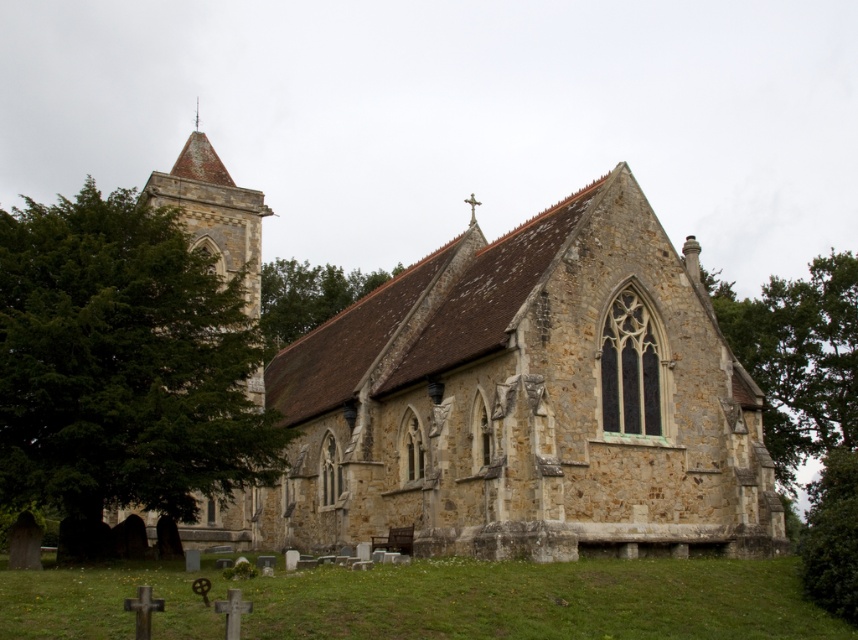
You are standing in front of the church and want to take a photo of the green leafy tree at left. Which direction should you face to capture it in your camera?

The green leafy tree at left is located at point 0.577 on the x axis and 0.142 on the y axis. Since the x coordinate is greater than 0.5, it is positioned to the right side of the image. Therefore, you should face to the right to capture the green leafy tree at left in your camera.

You are standing at the entrance of the church and want to take a photo of the green leafy tree at left. Which direction should you face to capture the tree in your view?

The green leafy tree at left is located at point 0.577 on the x and 0.142 on the y, so you should face towards the left side of the church to capture the tree in your view.

You are standing in front of the church and want to know which object is wider between the green leafy tree at left and the green grass at lower center. Can you determine which one is wider?

The green leafy tree at left is wider than the green grass at lower center because its width surpasses the grass.